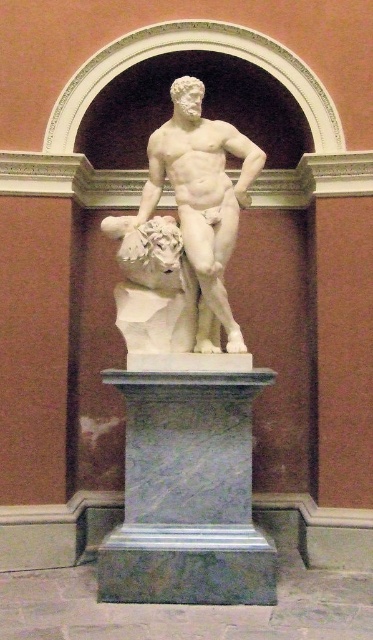
You are standing in front of the sculpture and want to determine which of the two points, point (207,380) or point (205,308), is closer to you. Based on the sculpture, which point is nearer?

Point (207,380) is closer to the viewer than point (205,308).

You are an art conservator assessing the stability of the gray marble pedestal at center and the white marble statue at center. Given their sizes, which object might require additional support to prevent tipping over?

The gray marble pedestal at center has a smaller size compared to the white marble statue at center, so it might require additional support to prevent tipping over since it has a narrower base.

You are an art conservator assessing the stability of the sculpture. Given that the gray marble pedestal at center supports the white marble statue at center, which object is positioned lower in the scene?

The gray marble pedestal at center is positioned below the white marble statue at center, so it is lower in the scene.